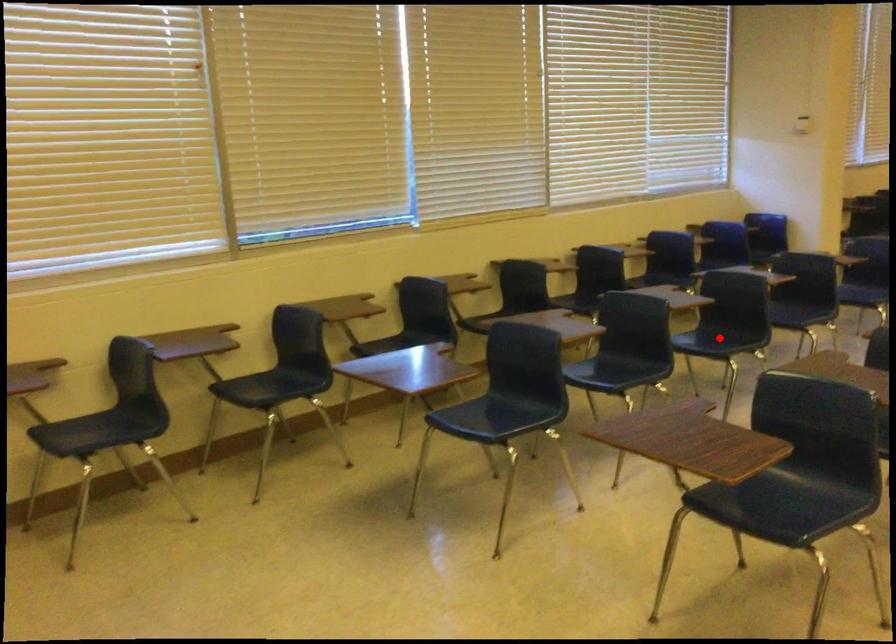
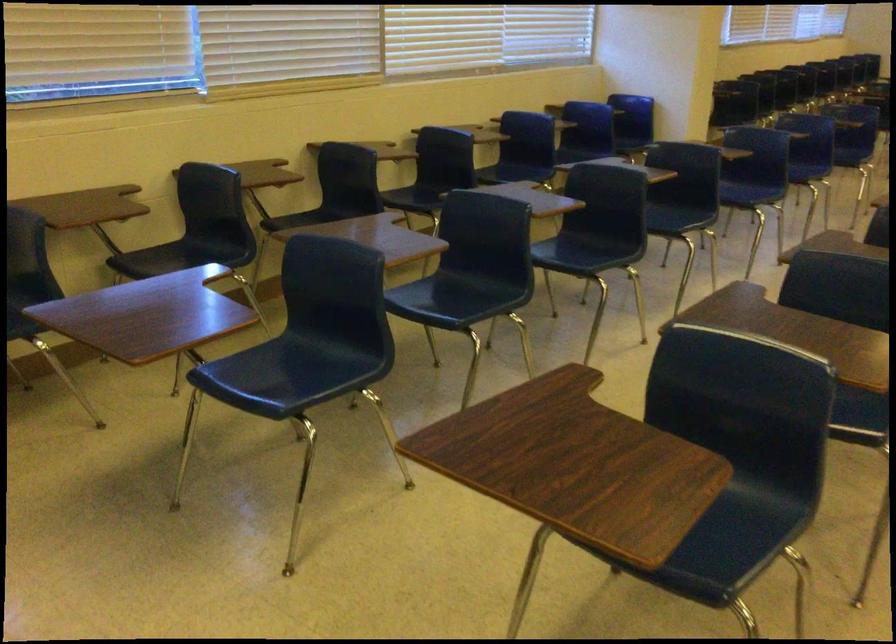
Where in the second image is the point corresponding to the highlighted location from the first image?

(586, 252)